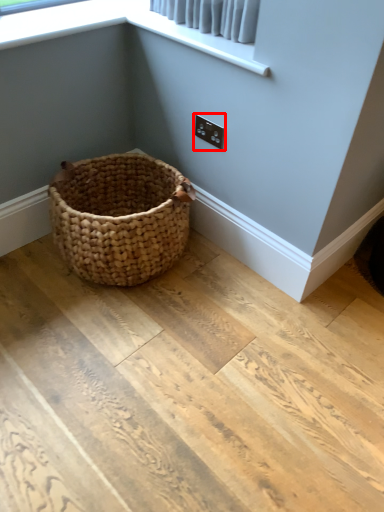
Question: From the image's perspective, considering the relative positions of electric outlet (annotated by the red box) and window screen in the image provided, where is electric outlet (annotated by the red box) located with respect to the staircase?

Choices:
 (A) above
 (B) below

Answer: (B)